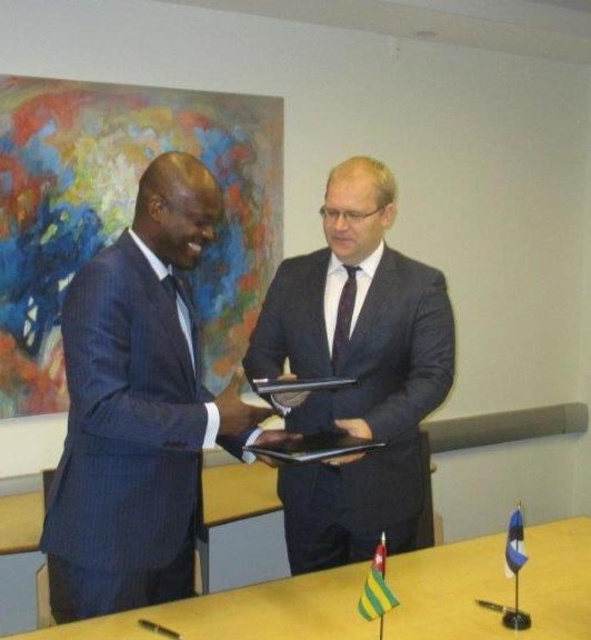
You are a photographer positioned behind the blue pinstripe suit at left and dark blue suit at center. You need to take a photo that captures both subjects clearly. Which subject should you focus on first to ensure both are in sharp focus?

You should focus on the dark blue suit at center first because it is further away from the photographer than the blue pinstripe suit at left, ensuring both are in focus when focusing on the farther subject.